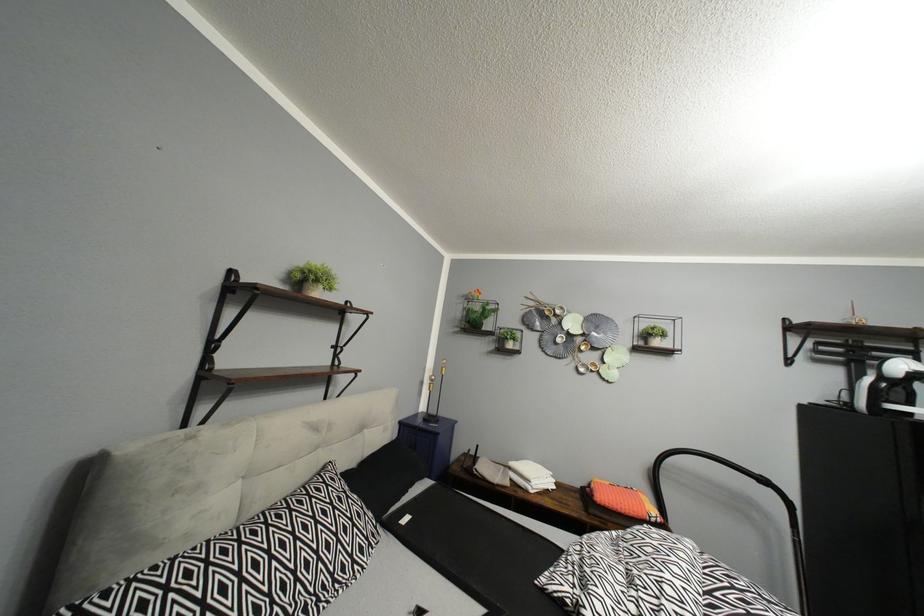
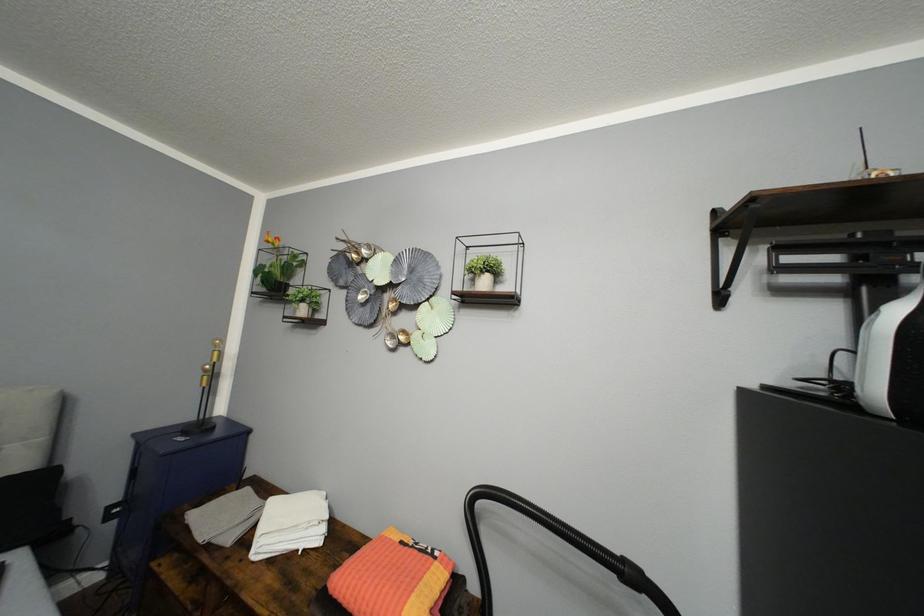
Which direction would the cameraman need to move to produce the second image?

The cameraman moved toward right, forward.